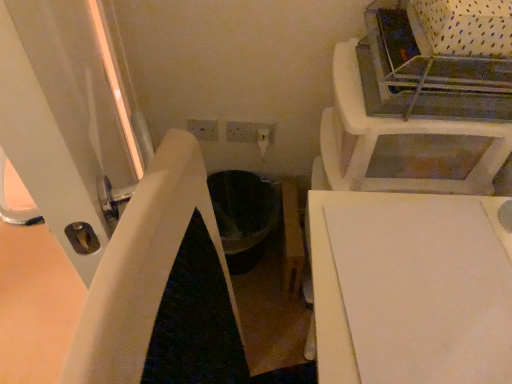
Locate an element on the screen. free space above white matte board at center (from a real-world perspective) is located at coordinates (436, 283).